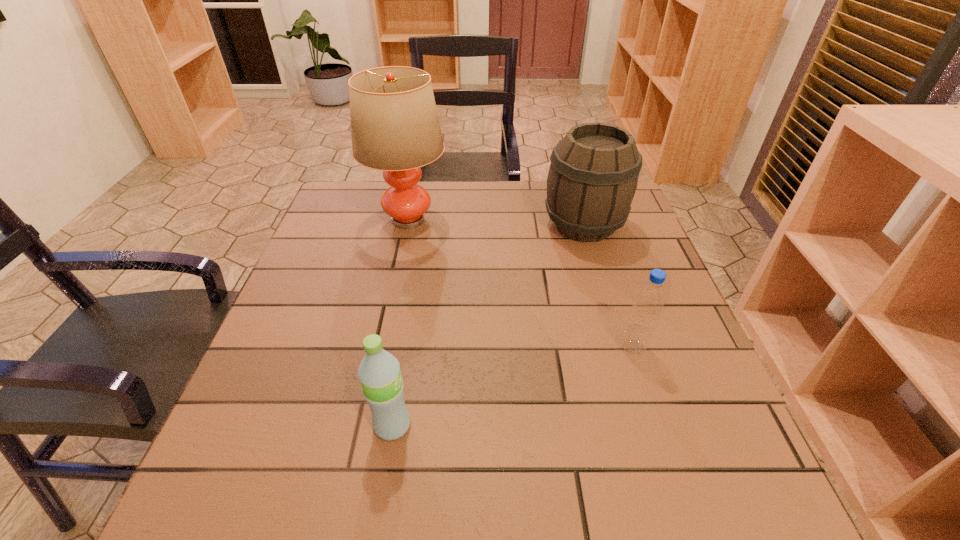
Find the location of a particular element. The width and height of the screenshot is (960, 540). free point at the right edge is located at coordinates (681, 340).

Where is `free location at the far left corner`? free location at the far left corner is located at coordinates (380, 192).

You are a GUI agent. You are given a task and a screenshot of the screen. Output one action in this format:
    pyautogui.click(x=<x>, y=<y>)
    Task: Click on the vacant space at the near right corner of the desktop
    This screenshot has height=540, width=960.
    Given the screenshot: What is the action you would take?
    pyautogui.click(x=668, y=469)

At what (x,y) coordinates should I click in order to perform the action: click on empty location between the second nearest object and the left water bottle. Please return your answer as a coordinate pair (x, y). The height and width of the screenshot is (540, 960). Looking at the image, I should click on (513, 386).

The width and height of the screenshot is (960, 540). In order to click on vacant area that lies between the nearest object and the tallest object in this screenshot , I will do tap(400, 322).

At what (x,y) coordinates should I click in order to perform the action: click on free space between the lamp and the farther water bottle. Please return your answer as a coordinate pair (x, y). Image resolution: width=960 pixels, height=540 pixels. Looking at the image, I should click on (520, 284).

Locate an element on the screen. free space between the farther water bottle and the wine bucket is located at coordinates tap(609, 286).

I want to click on free point between the tallest object and the farther water bottle, so click(x=520, y=284).

I want to click on empty space between the farther water bottle and the nearer water bottle, so click(x=513, y=386).

Find the location of `vacant area between the farther water bottle and the wine bucket`. vacant area between the farther water bottle and the wine bucket is located at coordinates (609, 286).